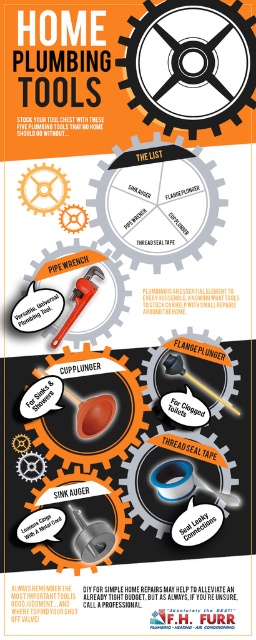
Question: Which point is farther to the camera?

Choices:
 (A) brushed metal sink auger at lower center
 (B) orange rubber cup plunger at center
 (C) matte black flange plunger at center

Answer: (C)

Question: Does brushed metal sink auger at lower center have a lesser width compared to matte orange pipe wrench at center?

Choices:
 (A) no
 (B) yes

Answer: (A)

Question: Among these objects, which one is farthest from the camera?

Choices:
 (A) orange rubber cup plunger at center
 (B) matte black flange plunger at center
 (C) matte orange pipe wrench at center

Answer: (B)

Question: Does orange rubber cup plunger at center have a lesser width compared to matte orange pipe wrench at center?

Choices:
 (A) no
 (B) yes

Answer: (A)

Question: Can you confirm if orange rubber cup plunger at center is positioned to the right of matte orange pipe wrench at center?

Choices:
 (A) no
 (B) yes

Answer: (A)

Question: Considering the real-world distances, which object is closest to the matte black flange plunger at center?

Choices:
 (A) orange rubber cup plunger at center
 (B) brushed metal sink auger at lower center

Answer: (A)